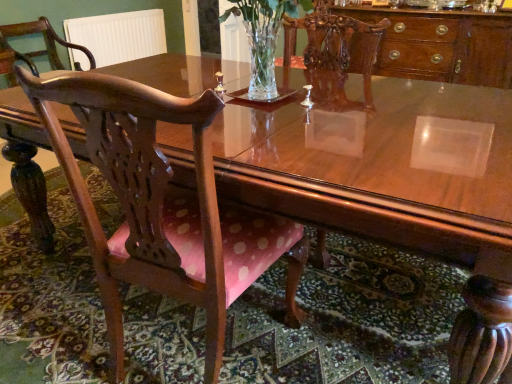
Question: From the image's perspective, relative to clear glass vase at center, is wooden chair with pink cushion at center, which ranks as the first chair in right-to-left order, above or below?

Choices:
 (A) below
 (B) above

Answer: (A)

Question: Considering the relative positions of wooden chair with pink cushion at center, which is the first chair from bottom to top, and clear glass vase at center in the image provided, is wooden chair with pink cushion at center, which is the first chair from bottom to top, to the left or to the right of clear glass vase at center?

Choices:
 (A) left
 (B) right

Answer: (A)

Question: Considering the real-world distances, which object is closest to the polished wood cabinet at upper right?

Choices:
 (A) wooden chair with pink cushion at center, which is the second chair from left to right
 (B) polished wood chair at left, which ranks as the 2th chair in right-to-left order
 (C) clear glass vase at center
 (D) white ribbed radiator at upper left

Answer: (C)

Question: Which object is the farthest from the white ribbed radiator at upper left?

Choices:
 (A) clear glass vase at center
 (B) polished wood chair at left, arranged as the 2th chair when viewed from the front
 (C) polished wood cabinet at upper right
 (D) wooden chair with pink cushion at center, acting as the first chair starting from the front

Answer: (D)